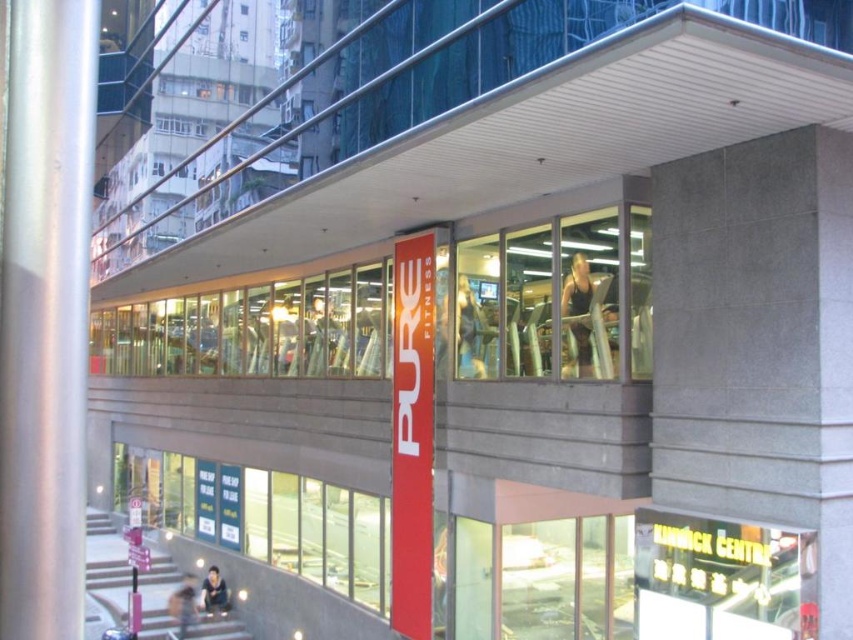
You are standing in front of the building and want to locate two specific points marked on the facade. The first point is at coordinates point (572,310) and the second at point (459,276). Which of these points is closer to you?

Point (572,310) is in front of point (459,276), so the first point is closer to you.

You are a fitness enthusiast looking to choose between two workout tops displayed in the PURE FITNESS building. The black matte tank top at center and the dark blue fabric shirt at lower center are both visible. Which one is positioned higher up in the display?

The black matte tank top at center is positioned higher up in the display than the dark blue fabric shirt at lower center.